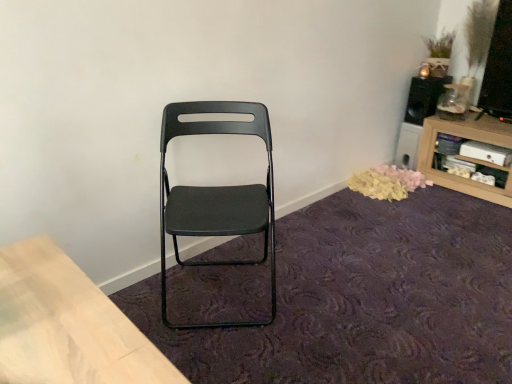
Locate an element on the screen. free spot to the right of matte black folding chair at center is located at coordinates (324, 296).